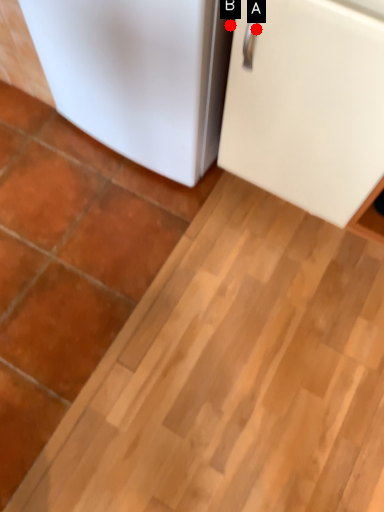
Question: Two points are circled on the image, labeled by A and B beside each circle. Which point is further to the camera?

Choices:
 (A) A is further
 (B) B is further

Answer: (B)